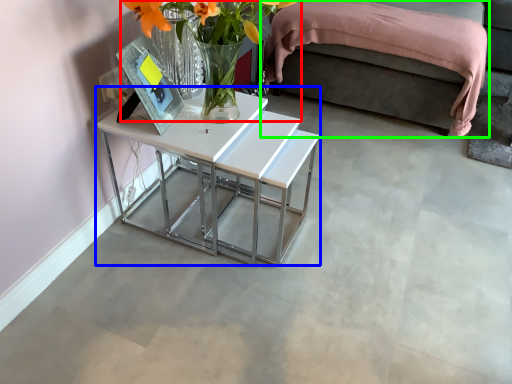
Question: Which object is positioned farthest from floral arrangement (highlighted by a red box)? Select from table (highlighted by a blue box) and bed (highlighted by a green box).

Choices:
 (A) table
 (B) bed

Answer: (B)